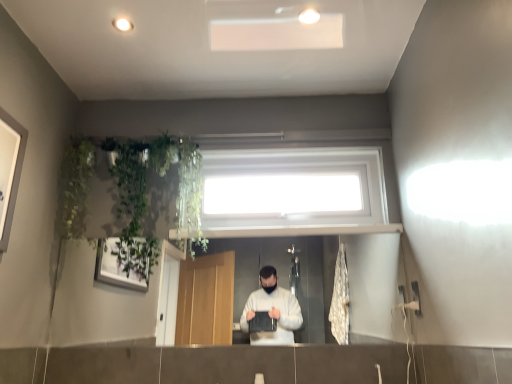
Question: In terms of size, does green leafy plant at upper left appear bigger or smaller than white plastic window at upper center?

Choices:
 (A) big
 (B) small

Answer: (B)

Question: Considering the relative positions of green leafy plant at upper left and white plastic window at upper center in the image provided, is green leafy plant at upper left to the left or to the right of white plastic window at upper center?

Choices:
 (A) right
 (B) left

Answer: (B)

Question: Is green leafy plant at upper left wider or thinner than white plastic window at upper center?

Choices:
 (A) wide
 (B) thin

Answer: (A)

Question: Is white plastic window at upper center taller or shorter than green leafy plant at upper left?

Choices:
 (A) short
 (B) tall

Answer: (A)

Question: From a real-world perspective, relative to green leafy plant at upper left, is white plastic window at upper center vertically above or below?

Choices:
 (A) above
 (B) below

Answer: (A)

Question: In the image, is white plastic window at upper center positioned in front of or behind green leafy plant at upper left?

Choices:
 (A) behind
 (B) front

Answer: (A)

Question: Considering the positions of point (376, 160) and point (68, 226), is point (376, 160) closer or farther from the camera than point (68, 226)?

Choices:
 (A) closer
 (B) farther

Answer: (B)